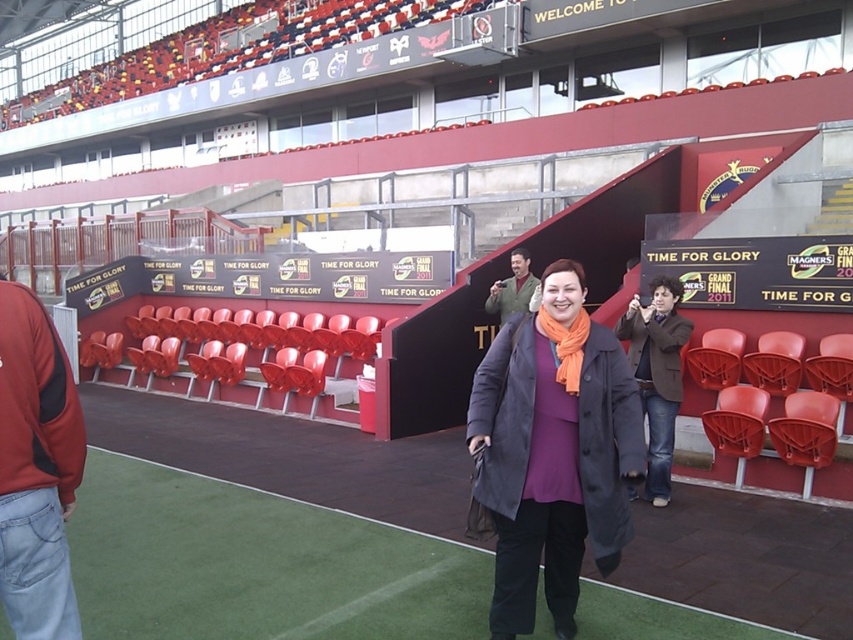
Looking at this image, you are a photographer trying to capture a closeup of the woman in the center. You need to ensure that both the brown leather jacket at center and the orange fabric scarf at center are visible in the frame. Given their sizes, which object should you focus on to ensure both are in the shot?

The brown leather jacket at center is wider than the orange fabric scarf at center, so focusing on the brown leather jacket at center will ensure both objects are visible in the frame.